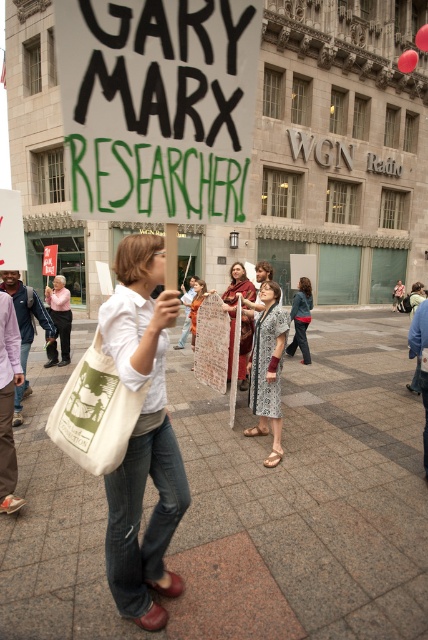
You are a photographer standing at the back of the crowd. You want to take a photo of both the matte red scarf at center and the matte white shirt at center in the same frame. Given that your camera has a minimum focus distance of 5 feet, will you be able to capture both objects in the photo?

The distance between the matte red scarf at center and the matte white shirt at center is 5.65 feet, which is greater than the camera minimum focus distance of 5 feet. Therefore, you can capture both objects in the same frame.

What is the spatial relationship between the matte pink shirt at center and the denim jacket at center in the scene?

The matte pink shirt at center is positioned below the denim jacket at center in the scene.